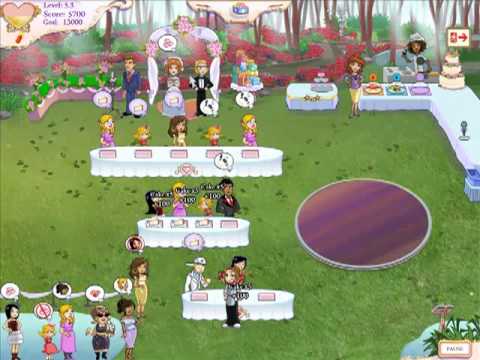
Image resolution: width=480 pixels, height=360 pixels. In order to click on pile of gifts in this screenshot , I will do `click(248, 74)`.